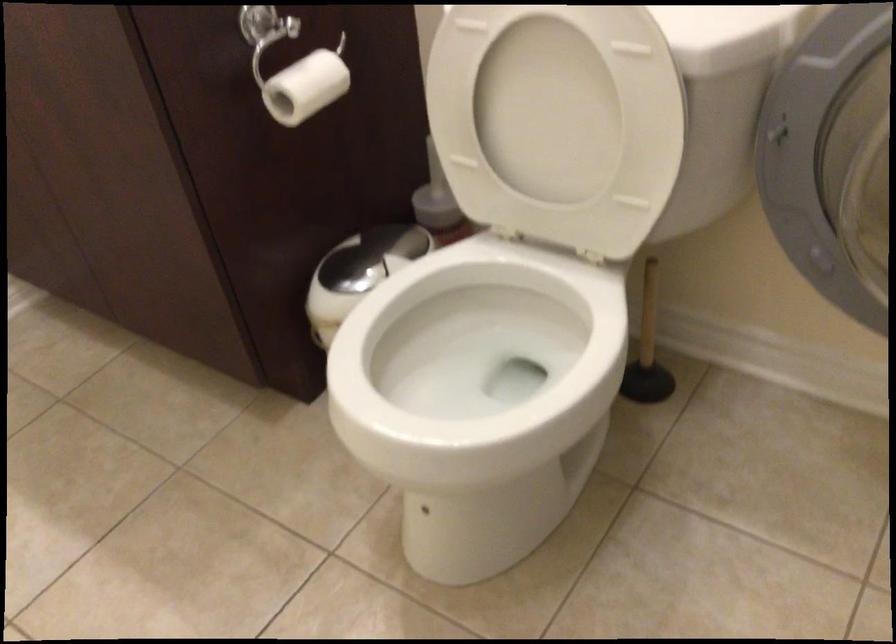
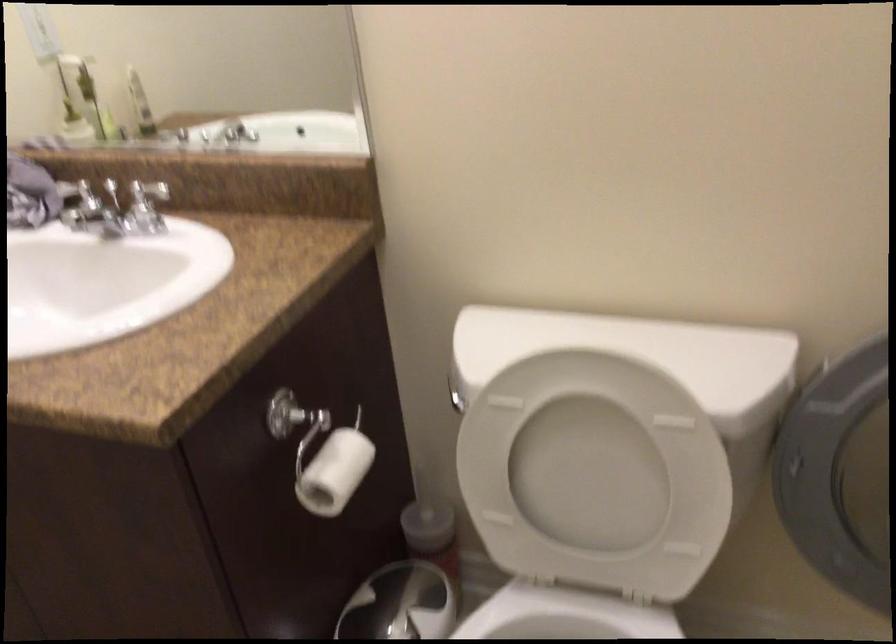
Question: The images are taken continuously from a first-person perspective. In which direction is your viewpoint rotating?

Choices:
 (A) Left
 (B) Right
 (C) Up
 (D) Down

Answer: (C)